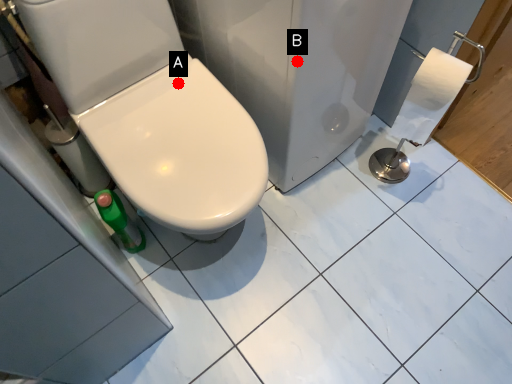
Question: Two points are circled on the image, labeled by A and B beside each circle. Which point is closer to the camera?

Choices:
 (A) A is closer
 (B) B is closer

Answer: (B)